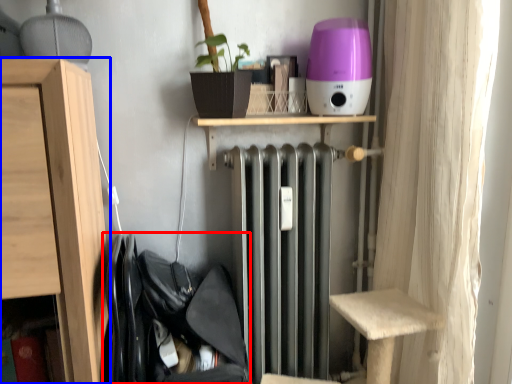
Question: Which object appears farthest to the camera in this image, laundry (highlighted by a red box) or furniture (highlighted by a blue box)?

Choices:
 (A) laundry
 (B) furniture

Answer: (A)